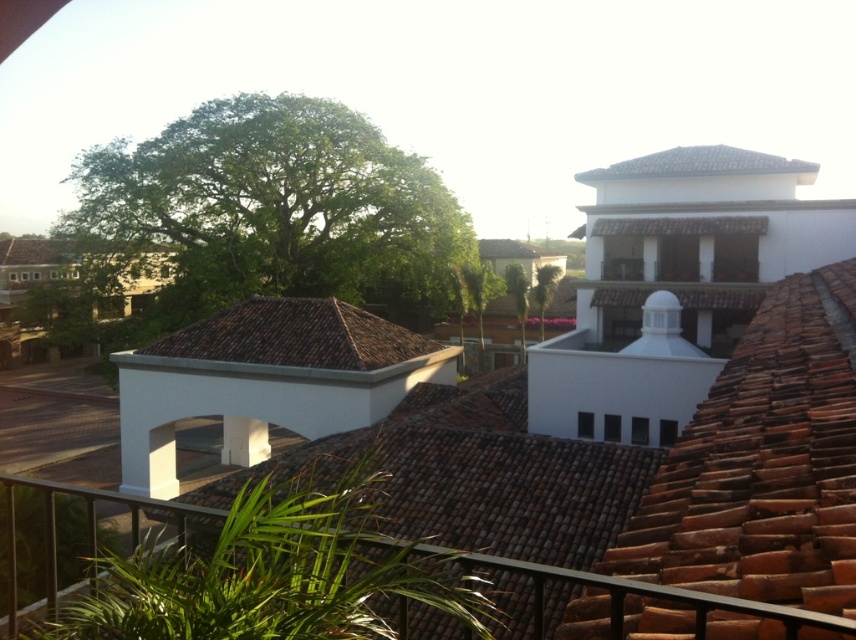
Which of these two, brown tile roof at center or brown tile roof at upper center, stands taller?

With more height is brown tile roof at upper center.

Does brown tile roof at center come in front of brown tile roof at upper center?

Yes, it is in front of brown tile roof at upper center.

Which is in front, point (360, 369) or point (593, 177)?

Point (360, 369)

Where is `brown tile roof at center`? Image resolution: width=856 pixels, height=640 pixels. brown tile roof at center is located at coordinates [294, 337].

Looking at this image, can you confirm if metallic gray railing at lower center is smaller than brown tile roof at upper center?

Yes.

Is metallic gray railing at lower center above brown tile roof at upper center?

No, metallic gray railing at lower center is not above brown tile roof at upper center.

Does point (405, 545) come closer to viewer compared to point (797, 168)?

Yes, it is.

This screenshot has height=640, width=856. Identify the location of metallic gray railing at lower center. (616, 589).

Is metallic gray railing at lower center taller than brown tile roof at center?

Indeed, metallic gray railing at lower center has a greater height compared to brown tile roof at center.

Find the location of a particular element. This screenshot has height=640, width=856. metallic gray railing at lower center is located at coordinates (616, 589).

Describe the element at coordinates (616, 589) in the screenshot. I see `metallic gray railing at lower center` at that location.

What are the coordinates of `metallic gray railing at lower center` in the screenshot? It's located at (616, 589).